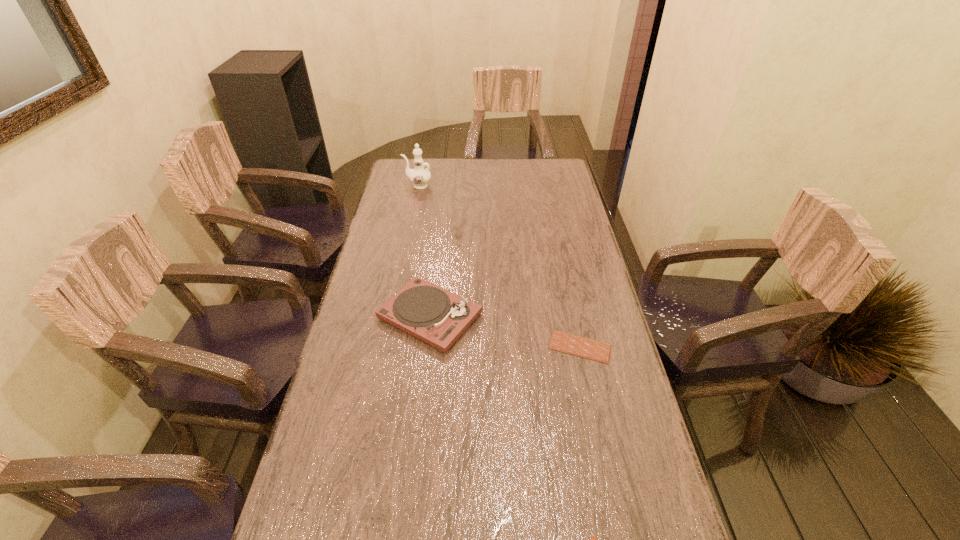
Where is `chinaware`? chinaware is located at coordinates (419, 176).

The height and width of the screenshot is (540, 960). Find the location of `the tallest object`. the tallest object is located at coordinates (419, 176).

At what (x,y) coordinates should I click in order to perform the action: click on the second tallest object. Please return your answer as a coordinate pair (x, y). The image size is (960, 540). Looking at the image, I should click on (438, 317).

Find the location of a particular element. The image size is (960, 540). the second shortest object is located at coordinates (567, 343).

The height and width of the screenshot is (540, 960). What are the coordinates of `the taller chocolate bar` in the screenshot? It's located at (567, 343).

Locate an element on the screen. The image size is (960, 540). vacant space located 0.340m on the back of the third shortest object is located at coordinates (441, 222).

Find the location of a particular element. This screenshot has width=960, height=540. vacant position located on the left of the farther chocolate bar is located at coordinates (440, 347).

Identify the location of object at the far edge. This screenshot has height=540, width=960. (419, 176).

Where is `chinaware at the left edge`? chinaware at the left edge is located at coordinates (419, 176).

Where is `phonograph_record present at the left edge`? phonograph_record present at the left edge is located at coordinates (438, 317).